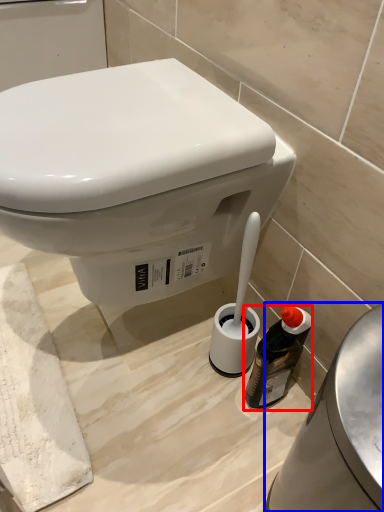
Question: Among these objects, which one is nearest to the camera, bottle (highlighted by a red box) or porcelain (highlighted by a blue box)?

Choices:
 (A) bottle
 (B) porcelain

Answer: (B)